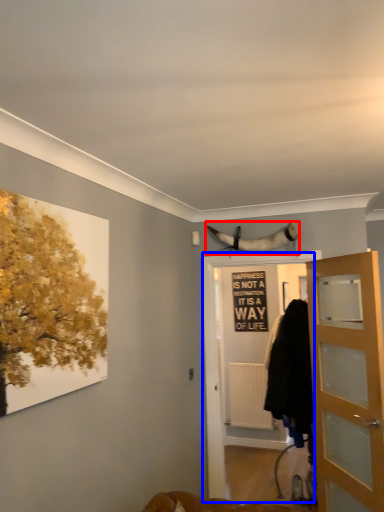
Question: Which of the following is the farthest to the observer, animal (highlighted by a red box) or screen door (highlighted by a blue box)?

Choices:
 (A) animal
 (B) screen door

Answer: (A)